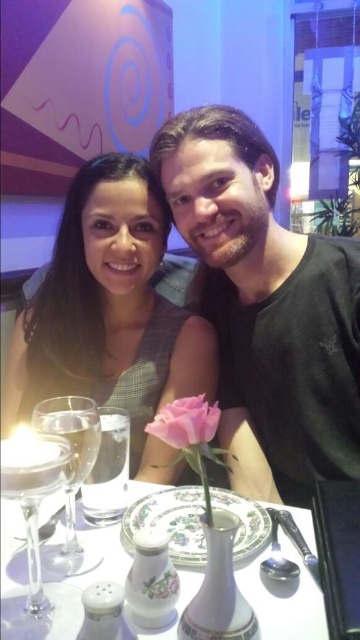
From the picture: Is matte black dress at center to the right of pink matte rose at center from the viewer's perspective?

Incorrect, matte black dress at center is not on the right side of pink matte rose at center.

Between point (113, 204) and point (190, 404), which one is positioned in front?

Point (190, 404)

Image resolution: width=360 pixels, height=640 pixels. Find the location of `matte black dress at center`. matte black dress at center is located at coordinates click(110, 314).

Who is higher up, porcelain vase at center or clear glass wine glass at left?

Positioned higher is clear glass wine glass at left.

Is point (281, 608) in front of point (5, 627)?

That is False.

Image resolution: width=360 pixels, height=640 pixels. What are the coordinates of `porcelain vase at center` in the screenshot? It's located at (284, 600).

Can you confirm if black matte shirt at center is positioned to the left of porcelain vase at center?

No, black matte shirt at center is not to the left of porcelain vase at center.

Who is taller, black matte shirt at center or porcelain vase at center?

black matte shirt at center

At what (x,y) coordinates should I click in order to perform the action: click on black matte shirt at center. Please return your answer as a coordinate pair (x, y). Image resolution: width=360 pixels, height=640 pixels. Looking at the image, I should click on (267, 300).